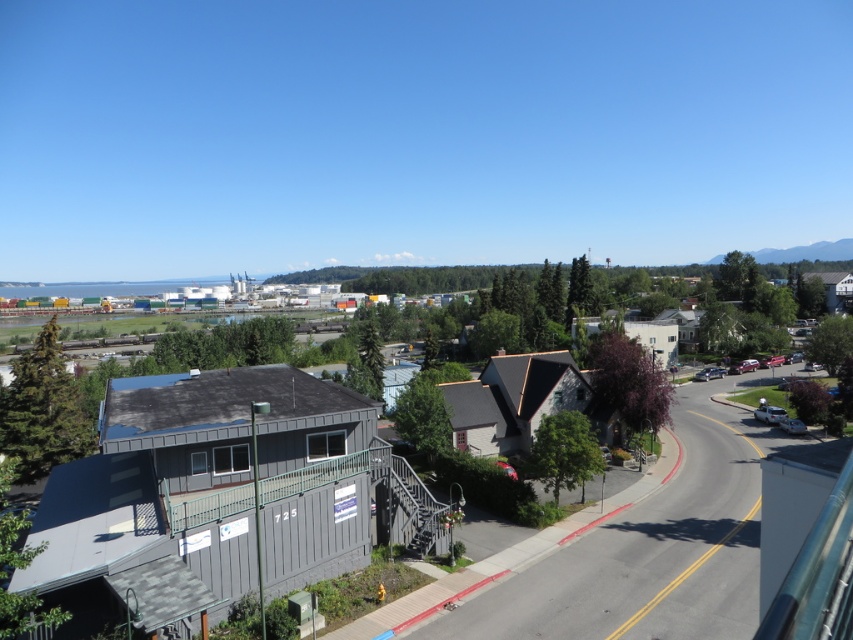
Is the position of metallic silver sedan at center-right more distant than that of silver metallic sedan at lower right?

Yes.

The height and width of the screenshot is (640, 853). What do you see at coordinates (741, 365) in the screenshot?
I see `metallic silver sedan at center-right` at bounding box center [741, 365].

The width and height of the screenshot is (853, 640). I want to click on metallic silver sedan at center-right, so click(741, 365).

Who is positioned more to the left, gray wood town at center or silver metallic sedan at lower right?

gray wood town at center

Which is behind, point (421, 625) or point (786, 422)?

Positioned behind is point (786, 422).

The width and height of the screenshot is (853, 640). I want to click on gray wood town at center, so click(x=648, y=548).

The height and width of the screenshot is (640, 853). I want to click on gray wood town at center, so click(648, 548).

Does gray wood town at center have a lesser height compared to metallic silver sedan at center-right?

In fact, gray wood town at center may be taller than metallic silver sedan at center-right.

Based on the photo, is gray wood town at center below metallic silver sedan at center-right?

Yes, gray wood town at center is below metallic silver sedan at center-right.

Describe the element at coordinates (648, 548) in the screenshot. The image size is (853, 640). I see `gray wood town at center` at that location.

At what (x,y) coordinates should I click in order to perform the action: click on gray wood town at center. Please return your answer as a coordinate pair (x, y). Looking at the image, I should click on (648, 548).